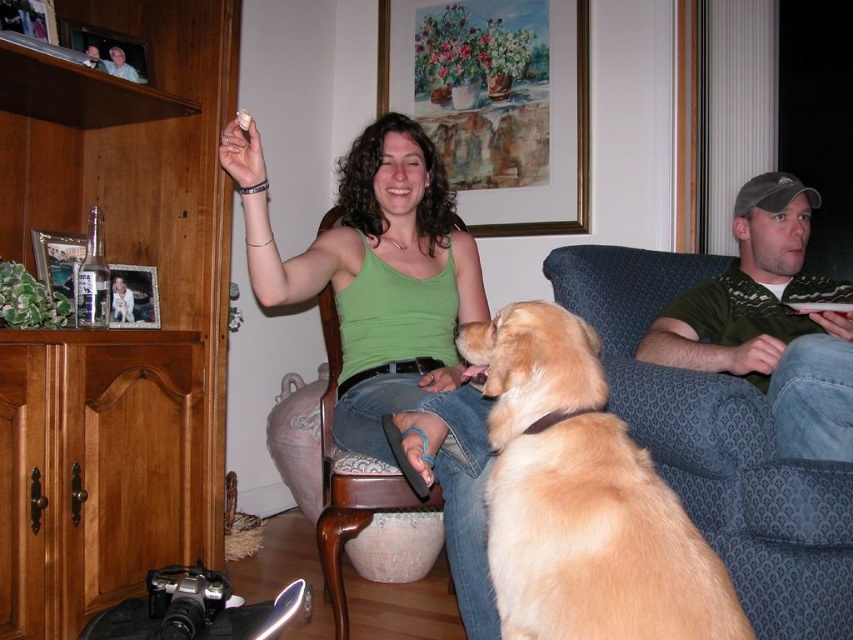
Describe the element at coordinates (581, 499) in the screenshot. This screenshot has height=640, width=853. I see `golden fur dog at right` at that location.

Looking at this image, which of these two, golden fur dog at right or blue fabric couch at center-right, stands shorter?

golden fur dog at right

Is point (534, 595) closer to viewer compared to point (747, 385)?

Yes, point (534, 595) is closer to viewer.

Locate an element on the screen. golden fur dog at right is located at coordinates (581, 499).

Can you confirm if blue fabric couch at center-right is thinner than green sweater at right?

Yes.

This screenshot has height=640, width=853. What are the coordinates of `blue fabric couch at center-right` in the screenshot? It's located at (718, 445).

At what (x,y) coordinates should I click in order to perform the action: click on blue fabric couch at center-right. Please return your answer as a coordinate pair (x, y). The image size is (853, 640). Looking at the image, I should click on (718, 445).

How distant is golden fur dog at right from green sweater at right?

golden fur dog at right and green sweater at right are 77.80 centimeters apart from each other.

Identify the location of golden fur dog at right. (581, 499).

The width and height of the screenshot is (853, 640). What do you see at coordinates (581, 499) in the screenshot? I see `golden fur dog at right` at bounding box center [581, 499].

This screenshot has width=853, height=640. Find the location of `golden fur dog at right`. golden fur dog at right is located at coordinates (581, 499).